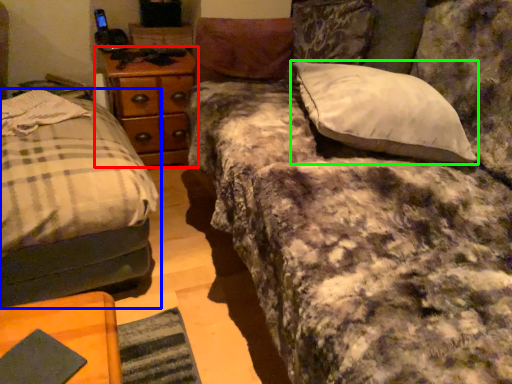
Question: Considering the real-world distances, which object is closest to nightstand (highlighted by a red box)? bed (highlighted by a blue box) or pillow (highlighted by a green box).

Choices:
 (A) bed
 (B) pillow

Answer: (A)